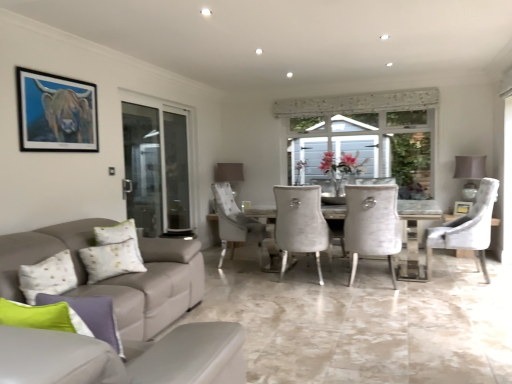
Question: Can you confirm if white textured chair at center, which is the 2th chair from right to left, is wider than light gray fabric couch at lower left?

Choices:
 (A) no
 (B) yes

Answer: (B)

Question: Is white textured chair at center, marked as the first chair in a left-to-right arrangement, in front of light gray fabric couch at lower left?

Choices:
 (A) yes
 (B) no

Answer: (B)

Question: Considering the relative sizes of white textured chair at center, marked as the first chair in a left-to-right arrangement, and light gray fabric couch at lower left in the image provided, is white textured chair at center, marked as the first chair in a left-to-right arrangement, thinner than light gray fabric couch at lower left?

Choices:
 (A) yes
 (B) no

Answer: (B)

Question: From a real-world perspective, is white textured chair at center, which is the 2th chair from right to left, physically above light gray fabric couch at lower left?

Choices:
 (A) yes
 (B) no

Answer: (B)

Question: Is the depth of white textured chair at center, marked as the first chair in a left-to-right arrangement, greater than that of light gray fabric couch at lower left?

Choices:
 (A) no
 (B) yes

Answer: (B)

Question: Is point (120, 243) positioned closer to the camera than point (19, 72)?

Choices:
 (A) closer
 (B) farther

Answer: (B)

Question: Relative to matte black frame at upper left, which appears as the second picture frame when ordered from the bottom, is white textured pillow at lower left, placed as the 1th pillow when sorted from back to front, in front or behind?

Choices:
 (A) front
 (B) behind

Answer: (B)

Question: Considering the positions of white textured pillow at lower left, which is counted as the first pillow, starting from the left, and matte black frame at upper left, which appears as the second picture frame when ordered from the bottom, in the image, is white textured pillow at lower left, which is counted as the first pillow, starting from the left, bigger or smaller than matte black frame at upper left, which appears as the second picture frame when ordered from the bottom,?

Choices:
 (A) small
 (B) big

Answer: (B)

Question: From a real-world perspective, relative to matte black frame at upper left, which appears as the second picture frame when ordered from the bottom, is white textured pillow at lower left, which is counted as the 2th pillow, starting from the front, vertically above or below?

Choices:
 (A) below
 (B) above

Answer: (A)

Question: In terms of size, does velvet white chair at right, the 2th chair viewed from the left, appear bigger or smaller than transparent glass screen door at left?

Choices:
 (A) small
 (B) big

Answer: (B)

Question: Visually, is velvet white chair at right, the 2th chair viewed from the left, positioned to the left or to the right of transparent glass screen door at left?

Choices:
 (A) left
 (B) right

Answer: (B)

Question: Is point coord(488,210) positioned closer to the camera than point coord(122,137)?

Choices:
 (A) farther
 (B) closer

Answer: (B)

Question: Is velvet white chair at right, the 2th chair viewed from the left, situated inside transparent glass screen door at left or outside?

Choices:
 (A) outside
 (B) inside

Answer: (A)

Question: Considering the positions of point (111, 266) and point (459, 205), is point (111, 266) closer or farther from the camera than point (459, 205)?

Choices:
 (A) farther
 (B) closer

Answer: (B)

Question: Considering the positions of white textured pillow at lower left, which is counted as the 2th pillow, starting from the front, and wooden picture frame at center, the 1th picture frame in the bottom-to-top sequence, in the image, is white textured pillow at lower left, which is counted as the 2th pillow, starting from the front, bigger or smaller than wooden picture frame at center, the 1th picture frame in the bottom-to-top sequence,?

Choices:
 (A) big
 (B) small

Answer: (A)